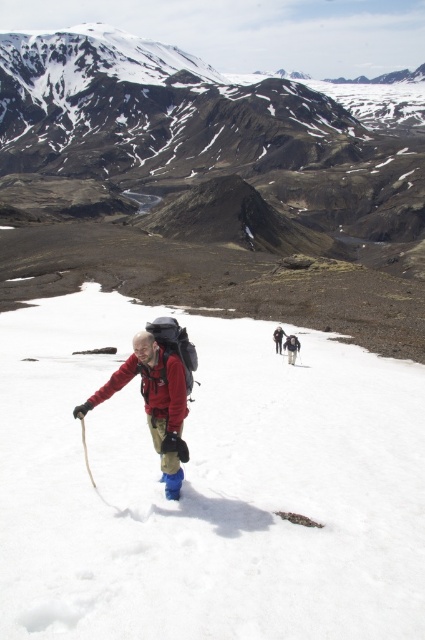
You are a photographer trying to capture a hiker in a matte red jacket at center and their dark gray backpack at center. If you want to ensure both are in focus, which object should you adjust your camera focus on first?

The matte red jacket at center is larger in size than the dark gray backpack at center, so you should focus on the matte red jacket at center first to ensure both are in focus.

You are a hiker planning to cross the white fluffy snow at center. Looking at the dark brown rocky mountain at upper center, which direction should you head towards to reach the mountain?

To reach the dark brown rocky mountain at upper center, you should head towards the upper direction since the white fluffy snow at center is in front of it, meaning the mountain is behind the snow in the upper part of the image.

You are a photographer trying to capture the hiker in the red jacket at center. You are standing at the point with coordinates (158,392). Can you see the red jacket at center from your current position?

Yes, the point (158,392) is on the matte red jacket at center, so you are standing directly on the red jacket at center and can see it clearly.